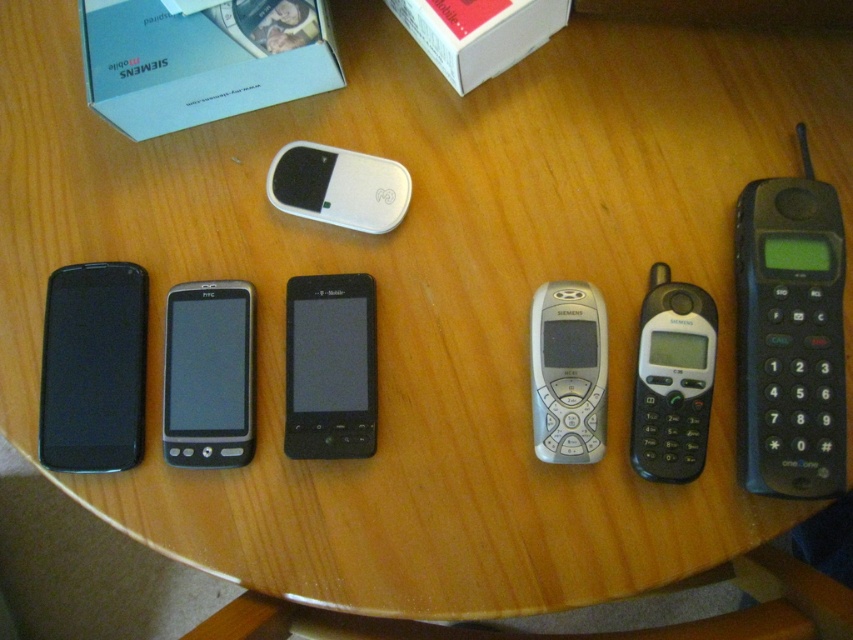
You are standing in front of the wooden table with the six mobile phones. There is a white cardboard box at upper left. Can you see the point at coordinates (x=202, y=60) from your current position?

Yes, the point at coordinates (x=202, y=60) is on the white cardboard box at upper left, so you can see it from your current position.

You are trying to place both the black glossy htc phone at center and the silver metallic phone at center into a rectangular phone case that can only accommodate one phone. Which phone should you choose to fit into the case if the case is designed for the narrower phone?

The silver metallic phone at center should be chosen because the black glossy htc phone at center is wider, so the case designed for the narrower phone would fit the silver metallic phone at center better.

Which phone is located at the coordinates point (209, 374)?

The point (209, 374) is located on the black glossy HTC phone at center.